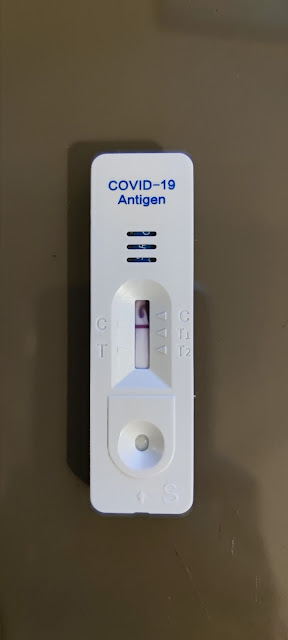
Find the location of a particular element. The image size is (288, 640). vents is located at coordinates (151, 234), (143, 246), (148, 258).